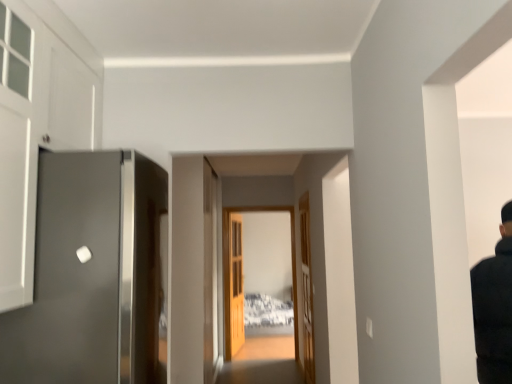
Question: Does clear glass door at center turn towards wooden door at center, positioned as the 1th door in back-to-front order?

Choices:
 (A) no
 (B) yes

Answer: (A)

Question: Is clear glass door at center further to camera compared to wooden door at center, which appears as the 3th door when viewed from the front?

Choices:
 (A) yes
 (B) no

Answer: (B)

Question: Is clear glass door at center positioned far away from wooden door at center, positioned as the 1th door in back-to-front order?

Choices:
 (A) yes
 (B) no

Answer: (B)

Question: Is clear glass door at center shorter than wooden door at center, which appears as the 3th door when viewed from the front?

Choices:
 (A) yes
 (B) no

Answer: (B)

Question: Would you say clear glass door at center is outside wooden door at center, which ranks as the 2th door in right-to-left order?

Choices:
 (A) no
 (B) yes

Answer: (B)

Question: Based on their sizes in the image, would you say wooden door at center, which appears as the second door when viewed from the left, is bigger or smaller than wooden door at center, the second door when ordered from back to front?

Choices:
 (A) small
 (B) big

Answer: (B)

Question: Looking at their shapes, would you say wooden door at center, which ranks as the 2th door in right-to-left order, is wider or thinner than wooden door at center, the second door when ordered from back to front?

Choices:
 (A) wide
 (B) thin

Answer: (A)

Question: From a real-world perspective, is wooden door at center, which appears as the 3th door when viewed from the front, above or below wooden door at center, the 2th door positioned from the front?

Choices:
 (A) below
 (B) above

Answer: (A)

Question: Does point (234, 271) appear closer or farther from the camera than point (310, 314)?

Choices:
 (A) closer
 (B) farther

Answer: (B)

Question: From the image's perspective, relative to satin gray door at left, acting as the third door starting from the back, is wooden door at center, which ranks as the 2th door in right-to-left order, above or below?

Choices:
 (A) below
 (B) above

Answer: (A)

Question: Looking at the image, does wooden door at center, positioned as the 1th door in back-to-front order, seem bigger or smaller compared to satin gray door at left, arranged as the third door when viewed from the right?

Choices:
 (A) small
 (B) big

Answer: (A)

Question: Considering the positions of point (234, 228) and point (52, 281), is point (234, 228) closer or farther from the camera than point (52, 281)?

Choices:
 (A) closer
 (B) farther

Answer: (B)

Question: Looking at their shapes, would you say wooden door at center, positioned as the 1th door in back-to-front order, is wider or thinner than satin gray door at left, acting as the 1th door starting from the front?

Choices:
 (A) wide
 (B) thin

Answer: (B)

Question: Considering the positions of clear glass door at center and wooden door at center, which appears as the 1th door when viewed from the right, in the image, is clear glass door at center wider or thinner than wooden door at center, which appears as the 1th door when viewed from the right,?

Choices:
 (A) wide
 (B) thin

Answer: (A)

Question: Based on their positions, is clear glass door at center located to the left or right of wooden door at center, the second door when ordered from back to front?

Choices:
 (A) right
 (B) left

Answer: (B)